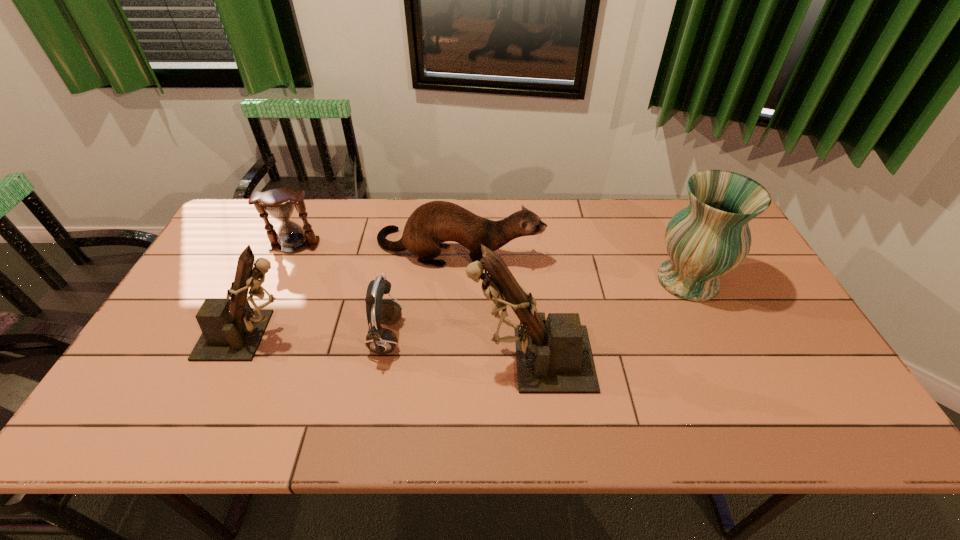
Please point a vacant point for placing a figurine on the right. Please provide its 2D coordinates. Your answer should be formatted as a tuple, i.e. [(x, y)], where the tuple contains the x and y coordinates of a point satisfying the conditions above.

[(835, 384)]